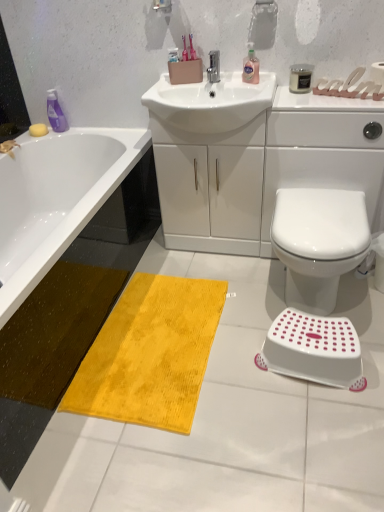
Where is `vacant area situated below yellow plush bath mat at center (from a real-world perspective)`? This screenshot has height=512, width=384. vacant area situated below yellow plush bath mat at center (from a real-world perspective) is located at coordinates (165, 340).